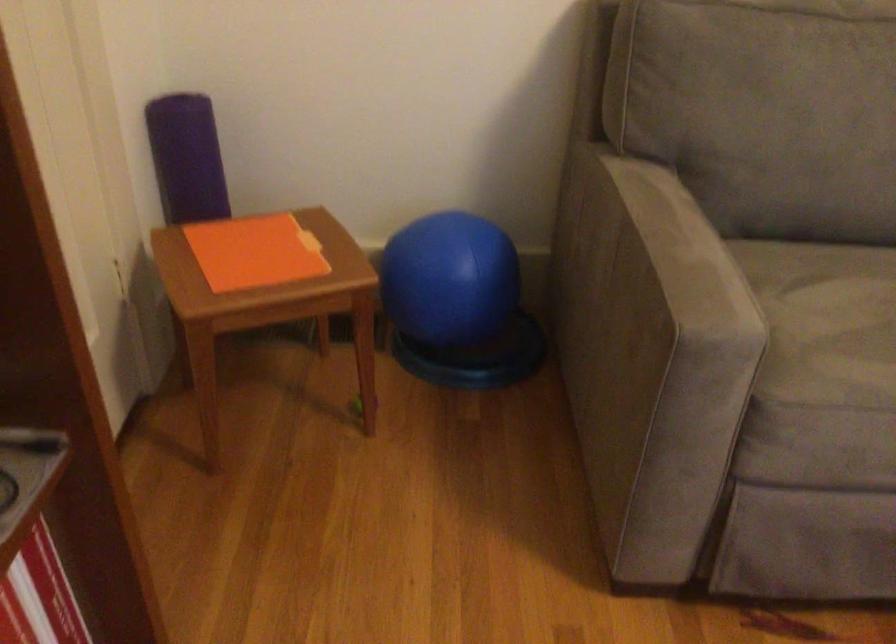
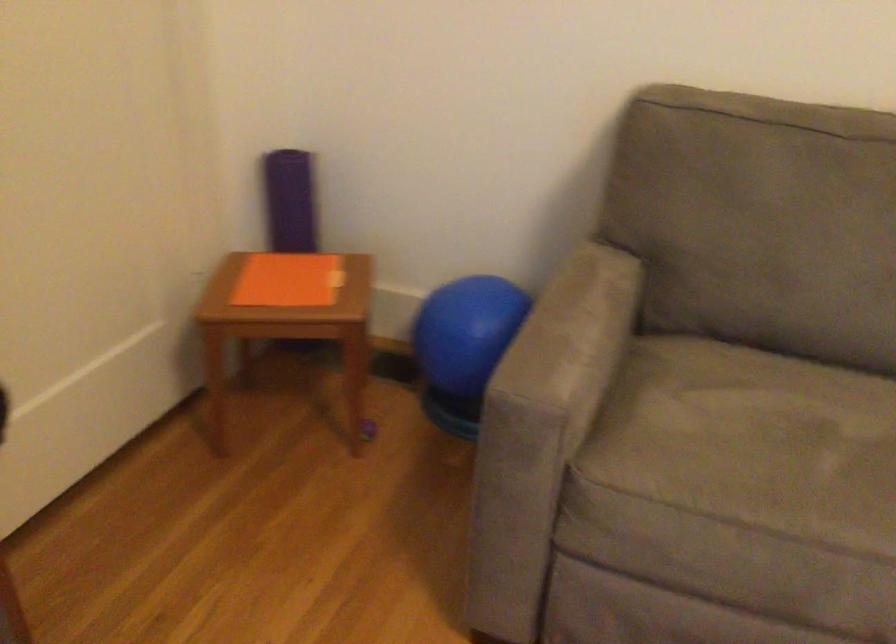
In the second image, find the point that corresponds to [209,158] in the first image.

(289, 201)